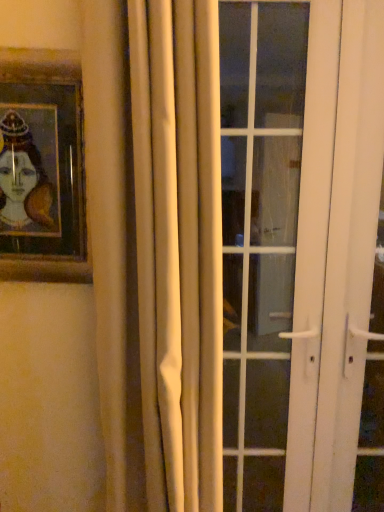
Question: Is white matte curtain at center shorter than wooden framed portrait at upper left?

Choices:
 (A) no
 (B) yes

Answer: (A)

Question: Is white matte curtain at center closer to the viewer compared to wooden framed portrait at upper left?

Choices:
 (A) yes
 (B) no

Answer: (A)

Question: Is white matte curtain at center in contact with wooden framed portrait at upper left?

Choices:
 (A) no
 (B) yes

Answer: (A)

Question: From the image's perspective, is white matte curtain at center beneath wooden framed portrait at upper left?

Choices:
 (A) yes
 (B) no

Answer: (A)

Question: From a real-world perspective, is white matte curtain at center located beneath wooden framed portrait at upper left?

Choices:
 (A) no
 (B) yes

Answer: (B)

Question: Can you confirm if white matte curtain at center is wider than wooden framed portrait at upper left?

Choices:
 (A) yes
 (B) no

Answer: (A)

Question: Is wooden framed portrait at upper left in contact with white glass door at center?

Choices:
 (A) no
 (B) yes

Answer: (A)

Question: Is wooden framed portrait at upper left wider than white glass door at center?

Choices:
 (A) no
 (B) yes

Answer: (A)

Question: Can you confirm if wooden framed portrait at upper left is shorter than white glass door at center?

Choices:
 (A) no
 (B) yes

Answer: (B)

Question: Would you say wooden framed portrait at upper left is a long distance from white glass door at center?

Choices:
 (A) yes
 (B) no

Answer: (A)

Question: Is wooden framed portrait at upper left located outside white glass door at center?

Choices:
 (A) yes
 (B) no

Answer: (A)

Question: Is wooden framed portrait at upper left smaller than white glass door at center?

Choices:
 (A) yes
 (B) no

Answer: (A)

Question: Is white glass door at center shorter than white matte curtain at center?

Choices:
 (A) no
 (B) yes

Answer: (A)